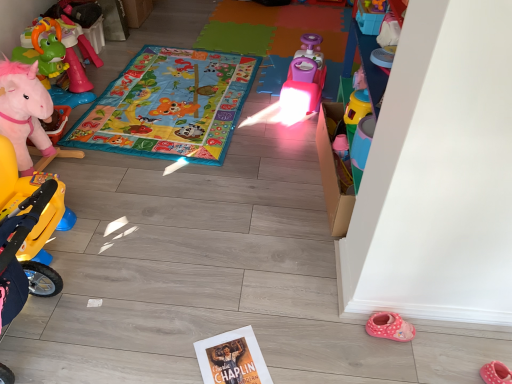
Where is `vacant area that is in front of multicolored fabric play mat at center`? Image resolution: width=512 pixels, height=384 pixels. vacant area that is in front of multicolored fabric play mat at center is located at coordinates (193, 213).